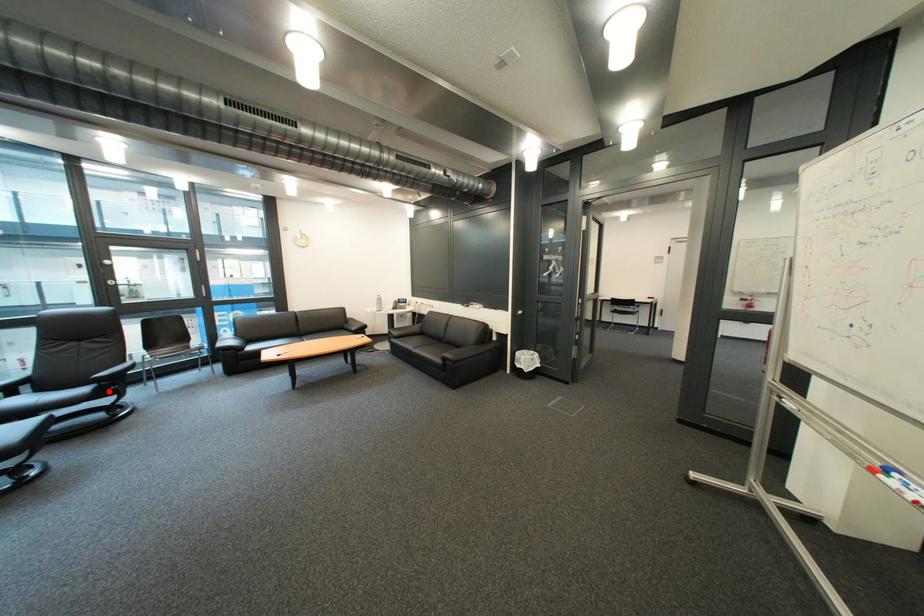
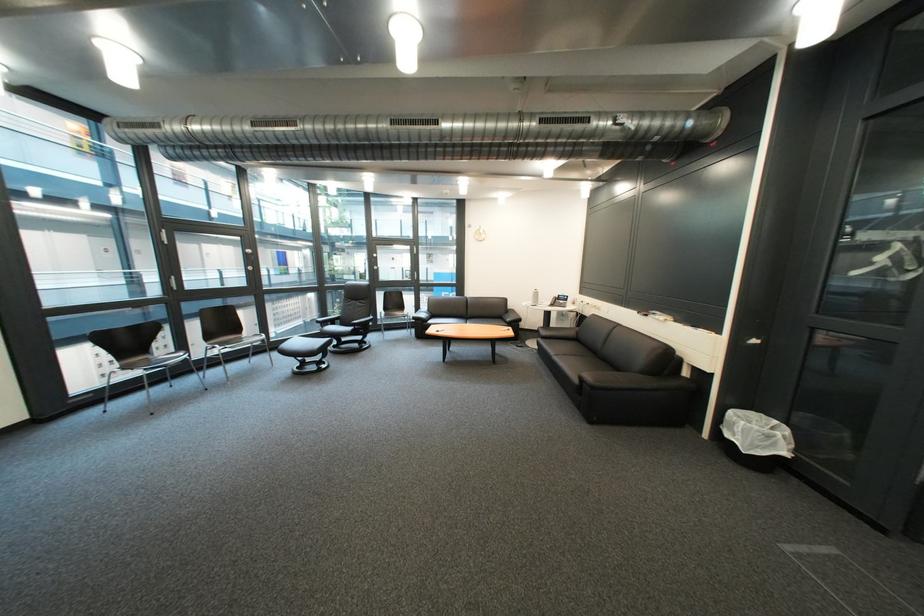
Find the pixel in the second image that matches the highlighted location in the first image.

(366, 331)